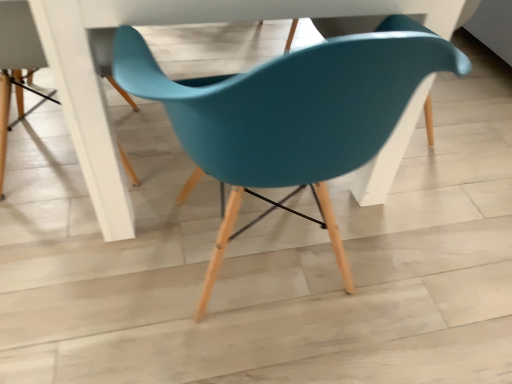
What do you see at coordinates (19, 39) in the screenshot? This screenshot has width=512, height=384. I see `teal plastic chair at upper center, which ranks as the 1th chair in left-to-right order` at bounding box center [19, 39].

The image size is (512, 384). In order to click on teal plastic chair at upper center, which ranks as the 1th chair in left-to-right order in this screenshot , I will do tap(19, 39).

You are a GUI agent. You are given a task and a screenshot of the screen. Output one action in this format:
    pyautogui.click(x=<x>, y=<y>)
    Task: Click on the teal plastic chair at center, the first chair in the right-to-left sequence
    
    Given the screenshot: What is the action you would take?
    pyautogui.click(x=290, y=116)

What do you see at coordinates (290, 116) in the screenshot? Image resolution: width=512 pixels, height=384 pixels. I see `teal plastic chair at center, which is the 2th chair in left-to-right order` at bounding box center [290, 116].

This screenshot has height=384, width=512. I want to click on teal plastic chair at upper center, which ranks as the 1th chair in left-to-right order, so click(x=19, y=39).

Between teal plastic chair at center, the first chair in the right-to-left sequence, and teal plastic chair at upper center, acting as the second chair starting from the right, which one appears on the right side from the viewer's perspective?

Positioned to the right is teal plastic chair at center, the first chair in the right-to-left sequence.

Is teal plastic chair at center, which is the 2th chair in left-to-right order, in front of or behind teal plastic chair at upper center, which ranks as the 1th chair in left-to-right order, in the image?

Visually, teal plastic chair at center, which is the 2th chair in left-to-right order, is located in front of teal plastic chair at upper center, which ranks as the 1th chair in left-to-right order.

Does point (267, 119) come farther from viewer compared to point (6, 33)?

No.

From the image's perspective, is teal plastic chair at center, which is the 2th chair in left-to-right order, located beneath teal plastic chair at upper center, which ranks as the 1th chair in left-to-right order?

Correct, teal plastic chair at center, which is the 2th chair in left-to-right order, appears lower than teal plastic chair at upper center, which ranks as the 1th chair in left-to-right order, in the image.

From a real-world perspective, which is physically below, teal plastic chair at center, which is the 2th chair in left-to-right order, or teal plastic chair at upper center, which ranks as the 1th chair in left-to-right order?

teal plastic chair at upper center, which ranks as the 1th chair in left-to-right order, from a real-world perspective.

Can you confirm if teal plastic chair at center, the first chair in the right-to-left sequence, is wider than teal plastic chair at upper center, acting as the second chair starting from the right?

Indeed, teal plastic chair at center, the first chair in the right-to-left sequence, has a greater width compared to teal plastic chair at upper center, acting as the second chair starting from the right.

Considering the relative sizes of teal plastic chair at center, the first chair in the right-to-left sequence, and teal plastic chair at upper center, acting as the second chair starting from the right, in the image provided, is teal plastic chair at center, the first chair in the right-to-left sequence, shorter than teal plastic chair at upper center, acting as the second chair starting from the right,?

No.

Considering the relative sizes of teal plastic chair at center, which is the 2th chair in left-to-right order, and teal plastic chair at upper center, acting as the second chair starting from the right, in the image provided, is teal plastic chair at center, which is the 2th chair in left-to-right order, bigger than teal plastic chair at upper center, acting as the second chair starting from the right,?

Yes.

Is teal plastic chair at upper center, which ranks as the 1th chair in left-to-right order, surrounded by teal plastic chair at center, which is the 2th chair in left-to-right order?

No.

Are teal plastic chair at center, which is the 2th chair in left-to-right order, and teal plastic chair at upper center, which ranks as the 1th chair in left-to-right order, far apart?

No, teal plastic chair at center, which is the 2th chair in left-to-right order, is in close proximity to teal plastic chair at upper center, which ranks as the 1th chair in left-to-right order.

Is teal plastic chair at center, which is the 2th chair in left-to-right order, oriented towards teal plastic chair at upper center, acting as the second chair starting from the right?

No, teal plastic chair at center, which is the 2th chair in left-to-right order, does not turn towards teal plastic chair at upper center, acting as the second chair starting from the right.

Based on the photo, measure the distance from teal plastic chair at center, which is the 2th chair in left-to-right order, to teal plastic chair at upper center, which ranks as the 1th chair in left-to-right order.

The distance of teal plastic chair at center, which is the 2th chair in left-to-right order, from teal plastic chair at upper center, which ranks as the 1th chair in left-to-right order, is 15.71 inches.

Where is `chair in front of the teal plastic chair at upper center, which ranks as the 1th chair in left-to-right order`? This screenshot has width=512, height=384. chair in front of the teal plastic chair at upper center, which ranks as the 1th chair in left-to-right order is located at coordinates coord(290,116).

Is teal plastic chair at upper center, which ranks as the 1th chair in left-to-right order, at the right side of teal plastic chair at center, the first chair in the right-to-left sequence?

No, teal plastic chair at upper center, which ranks as the 1th chair in left-to-right order, is not to the right of teal plastic chair at center, the first chair in the right-to-left sequence.

Which object is closer to the camera taking this photo, teal plastic chair at upper center, acting as the second chair starting from the right, or teal plastic chair at center, which is the 2th chair in left-to-right order?

teal plastic chair at center, which is the 2th chair in left-to-right order, is closer to the camera.

Which is nearer, (16, 55) or (258, 121)?

The point (258, 121) is closer.

From the image's perspective, which is below, teal plastic chair at upper center, which ranks as the 1th chair in left-to-right order, or teal plastic chair at center, which is the 2th chair in left-to-right order?

teal plastic chair at center, which is the 2th chair in left-to-right order, appears lower in the image.

From a real-world perspective, which object rests below the other?

In real-world perspective, teal plastic chair at upper center, which ranks as the 1th chair in left-to-right order, is lower.

From the picture: Considering the sizes of teal plastic chair at upper center, acting as the second chair starting from the right, and teal plastic chair at center, which is the 2th chair in left-to-right order, in the image, is teal plastic chair at upper center, acting as the second chair starting from the right, wider or thinner than teal plastic chair at center, which is the 2th chair in left-to-right order,?

In the image, teal plastic chair at upper center, acting as the second chair starting from the right, appears to be more narrow than teal plastic chair at center, which is the 2th chair in left-to-right order.

From the picture: From their relative heights in the image, would you say teal plastic chair at upper center, which ranks as the 1th chair in left-to-right order, is taller or shorter than teal plastic chair at center, the first chair in the right-to-left sequence?

Clearly, teal plastic chair at upper center, which ranks as the 1th chair in left-to-right order, is shorter compared to teal plastic chair at center, the first chair in the right-to-left sequence.

Based on the photo, considering the relative sizes of teal plastic chair at upper center, acting as the second chair starting from the right, and teal plastic chair at center, the first chair in the right-to-left sequence, in the image provided, is teal plastic chair at upper center, acting as the second chair starting from the right, bigger than teal plastic chair at center, the first chair in the right-to-left sequence,?

Actually, teal plastic chair at upper center, acting as the second chair starting from the right, might be smaller than teal plastic chair at center, the first chair in the right-to-left sequence.

Consider the image. Do you think teal plastic chair at upper center, acting as the second chair starting from the right, is within teal plastic chair at center, which is the 2th chair in left-to-right order, or outside of it?

teal plastic chair at upper center, acting as the second chair starting from the right, is outside teal plastic chair at center, which is the 2th chair in left-to-right order.

Is teal plastic chair at upper center, which ranks as the 1th chair in left-to-right order, far from teal plastic chair at center, which is the 2th chair in left-to-right order?

No.

Is teal plastic chair at upper center, which ranks as the 1th chair in left-to-right order, facing away from teal plastic chair at center, the first chair in the right-to-left sequence?

That's not correct — teal plastic chair at upper center, which ranks as the 1th chair in left-to-right order, is not looking away from teal plastic chair at center, the first chair in the right-to-left sequence.

I want to click on chair that is in front of the teal plastic chair at upper center, acting as the second chair starting from the right, so click(x=290, y=116).

The height and width of the screenshot is (384, 512). In order to click on chair that appears on the right of teal plastic chair at upper center, acting as the second chair starting from the right in this screenshot , I will do `click(290, 116)`.

I want to click on chair on the left of teal plastic chair at center, the first chair in the right-to-left sequence, so click(x=19, y=39).